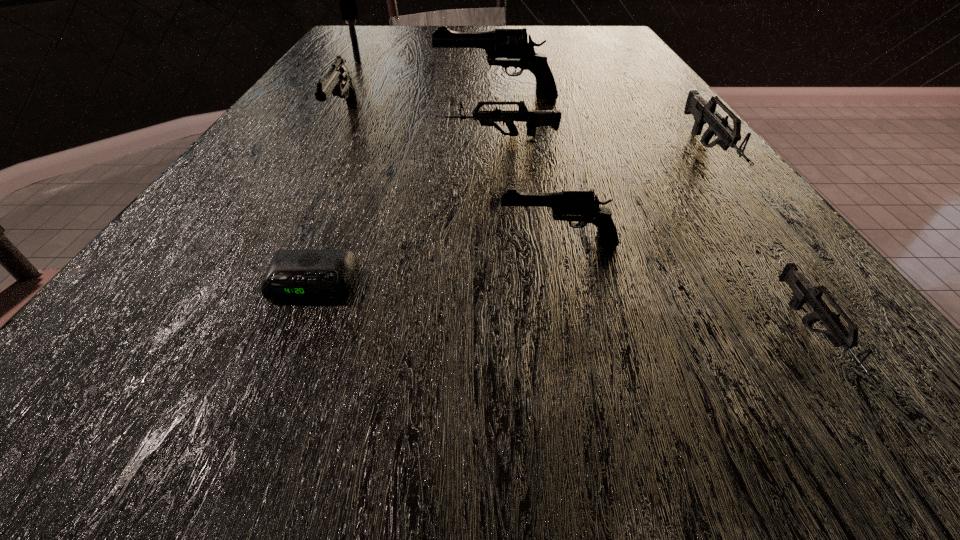
In order to click on the second biggest grey gun in this screenshot , I will do click(x=534, y=118).

Where is `the leftmost grey gun`? This screenshot has width=960, height=540. the leftmost grey gun is located at coordinates (534, 118).

Image resolution: width=960 pixels, height=540 pixels. I want to click on the second grey gun from right to left, so click(x=804, y=292).

Where is `the nearest grey gun`? This screenshot has height=540, width=960. the nearest grey gun is located at coordinates (804, 292).

In order to click on the shortest object in this screenshot , I will do `click(292, 274)`.

At what (x,y) coordinates should I click in order to perform the action: click on vacant space situated 0.160m on the right of the leftmost object. Please return your answer as a coordinate pair (x, y). Image resolution: width=960 pixels, height=540 pixels. Looking at the image, I should click on (427, 63).

I want to click on free spot located at the end of the barrel of the tallest gun, so click(369, 98).

I want to click on vacant point located at the end of the barrel of the tallest gun, so click(x=365, y=98).

Where is `vacant space located at the end of the barrel of the tallest gun`? This screenshot has width=960, height=540. vacant space located at the end of the barrel of the tallest gun is located at coordinates (293, 98).

Locate an element on the screen. The image size is (960, 540). free space located 0.110m at the end of the barrel of the leftmost gun is located at coordinates (316, 178).